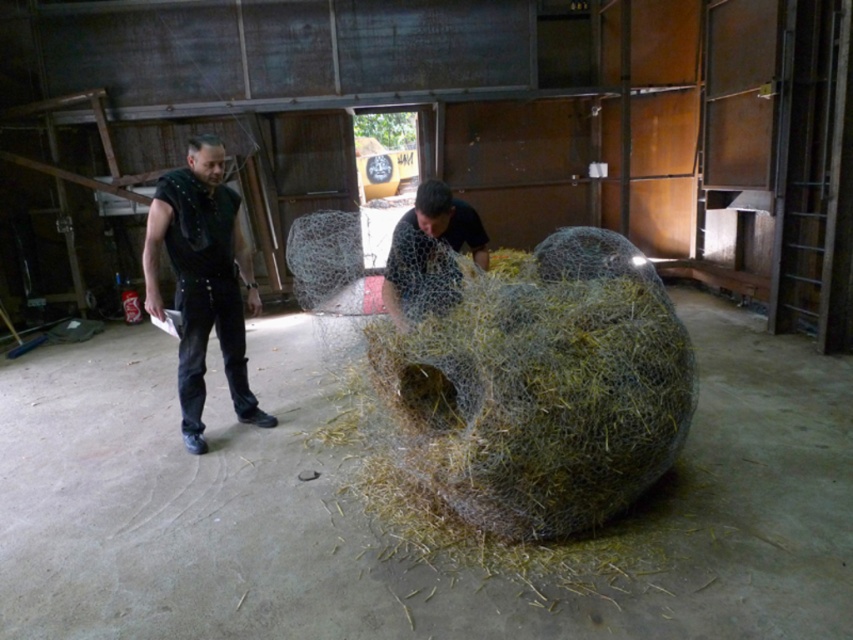
Does point (204, 196) come in front of point (392, 243)?

No.

Between black studded leather vest at left and mesh fabric figure at center, which one has more height?

Standing taller between the two is black studded leather vest at left.

This screenshot has height=640, width=853. What do you see at coordinates (202, 280) in the screenshot?
I see `black studded leather vest at left` at bounding box center [202, 280].

Locate an element on the screen. black studded leather vest at left is located at coordinates (202, 280).

Describe the element at coordinates (520, 403) in the screenshot. I see `natural straw sculpture at center` at that location.

Is natural straw sculpture at center thinner than black studded leather vest at left?

No.

You are a GUI agent. You are given a task and a screenshot of the screen. Output one action in this format:
    pyautogui.click(x=<x>, y=<y>)
    Task: Click on the natural straw sculpture at center
    This screenshot has height=640, width=853.
    Given the screenshot: What is the action you would take?
    pyautogui.click(x=520, y=403)

In order to click on natural straw sculpture at center in this screenshot , I will do coord(520,403).

The height and width of the screenshot is (640, 853). What do you see at coordinates (520, 403) in the screenshot?
I see `natural straw sculpture at center` at bounding box center [520, 403].

This screenshot has width=853, height=640. What do you see at coordinates (520, 403) in the screenshot?
I see `natural straw sculpture at center` at bounding box center [520, 403].

Identify the location of natural straw sculpture at center. Image resolution: width=853 pixels, height=640 pixels. point(520,403).